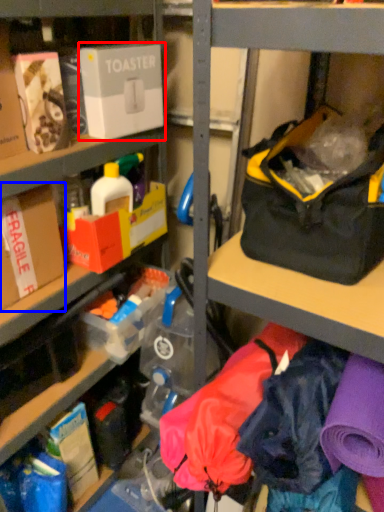
Question: Which of the following is the farthest to the observer, box (highlighted by a red box) or box (highlighted by a blue box)?

Choices:
 (A) box
 (B) box

Answer: (A)